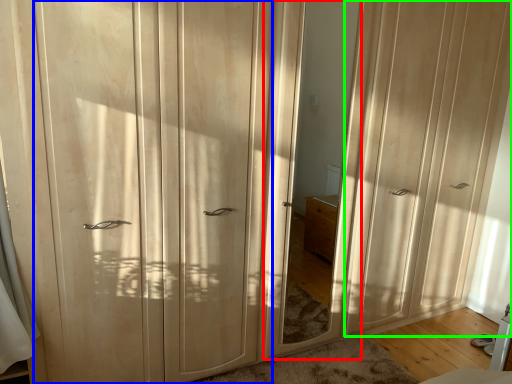
Question: Based on their relative distances, which object is farther from mirror (highlighted by a red box)? Choose from screen door (highlighted by a blue box) and screen door (highlighted by a green box).

Choices:
 (A) screen door
 (B) screen door

Answer: (A)